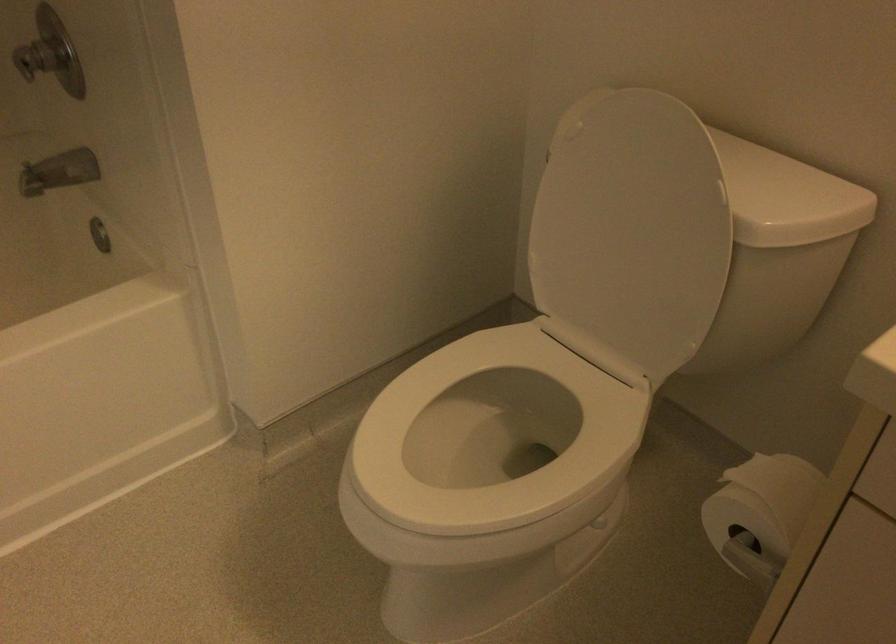
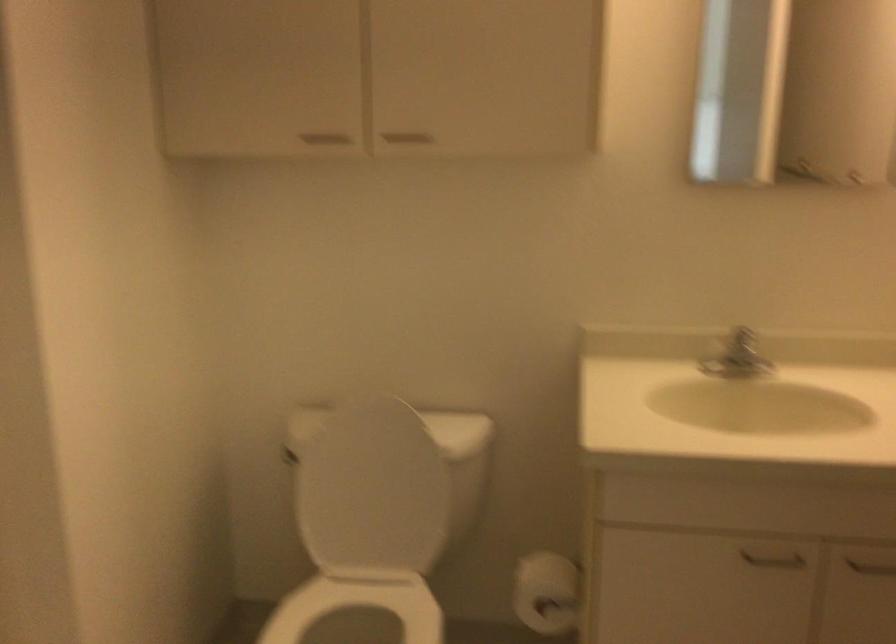
In the second image, find the point that corresponds to [755,518] in the first image.

(547, 592)